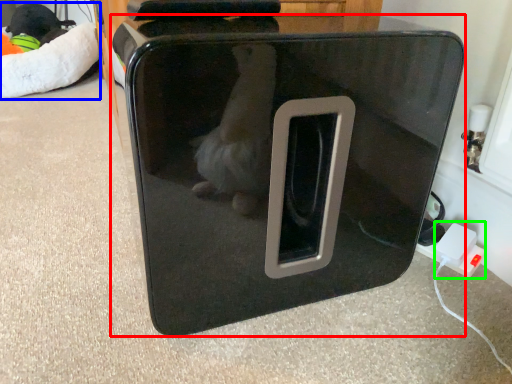
Question: Based on their relative distances, which object is nearer to home appliance (highlighted by a red box)? Choose from bean bag chair (highlighted by a blue box) and electric outlet (highlighted by a green box).

Choices:
 (A) bean bag chair
 (B) electric outlet

Answer: (B)